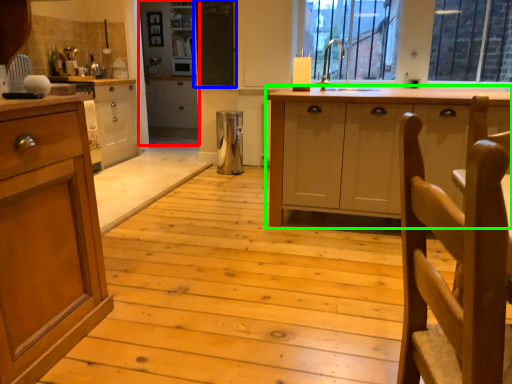
Question: Considering the real-world distances, which object is farthest from screen door (highlighted by a red box)? bulletin board (highlighted by a blue box) or cabinetry (highlighted by a green box)?

Choices:
 (A) bulletin board
 (B) cabinetry

Answer: (B)